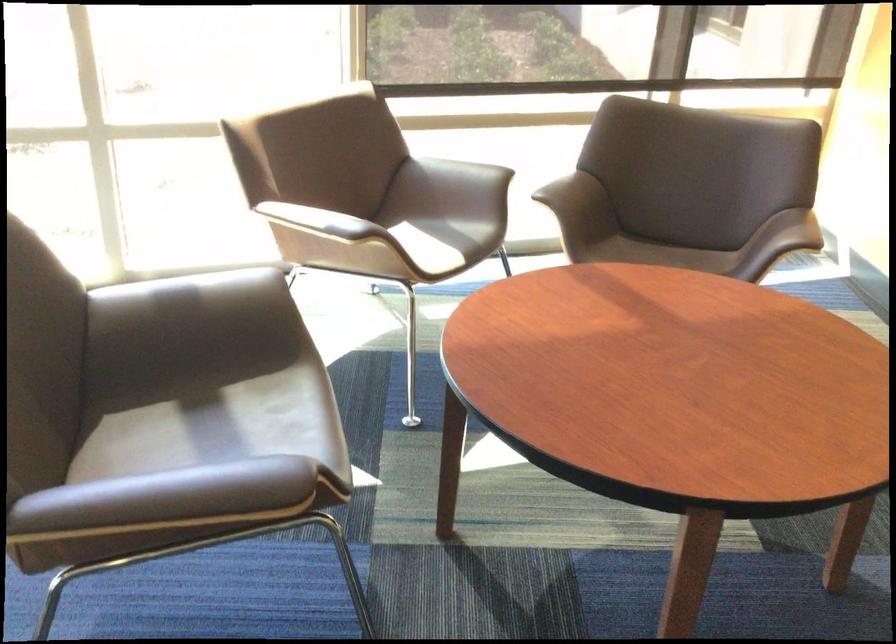
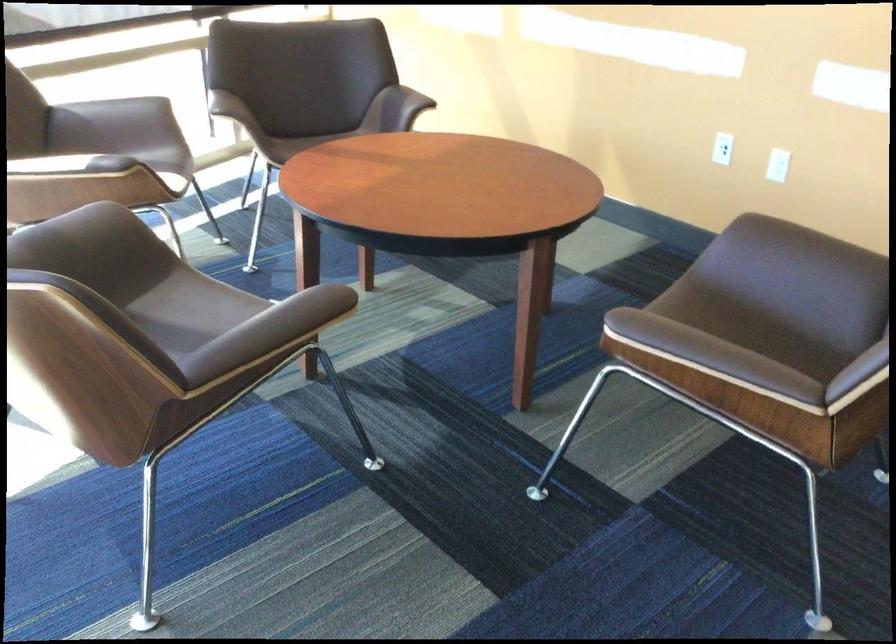
Find the pixel in the second image that matches [224,289] in the first image.

(76, 232)